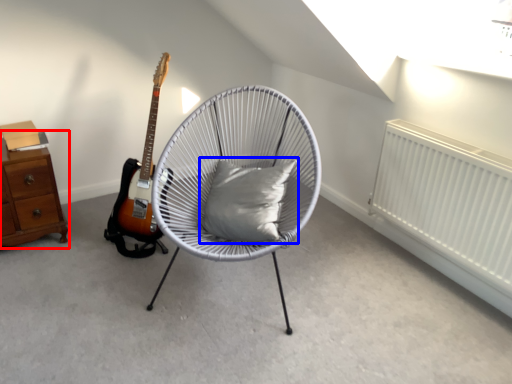
Question: Which of the following is the farthest to the observer, chest of drawers (highlighted by a red box) or pillow (highlighted by a blue box)?

Choices:
 (A) chest of drawers
 (B) pillow

Answer: (A)